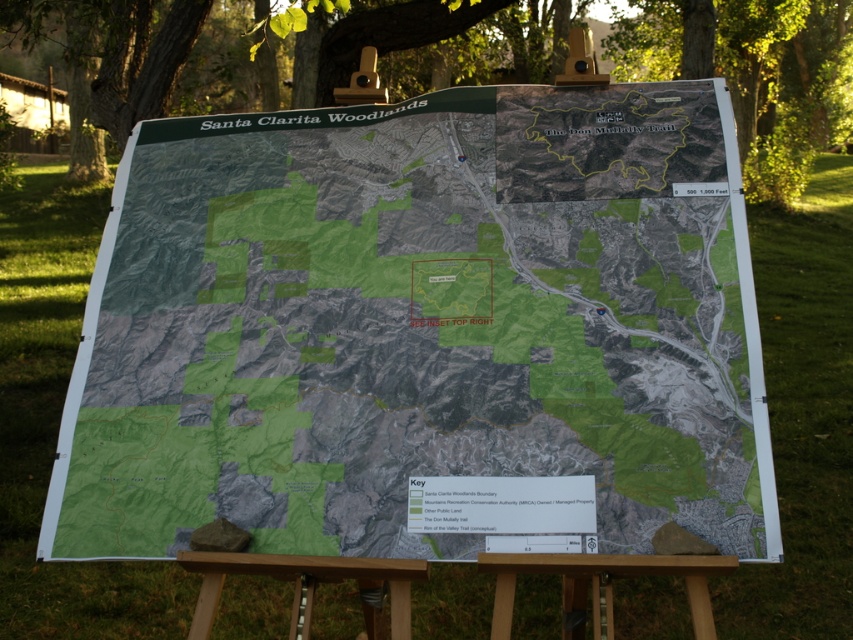
From the picture: You are standing in front of the map titled Santa Clarita Woodlands displayed on an easel. You see two points marked on the map at coordinates point (x=126, y=483) and point (x=815, y=35). If you want to touch the point that is closer to you, which coordinate should you reach for?

You should reach for point (x=126, y=483) because it is closer to the camera than point (x=815, y=35).

You are a hiker planning to use the map displayed on the easel. You notice the green textured map at center and the green leafy tree at upper center. Which object is smaller in size?

The green textured map at center has a smaller size compared to the green leafy tree at upper center, so the map is smaller.

Looking at this image, you are a hiker who wants to consult the map displayed on the easel to plan your route. However, you notice that the green leafy tree at upper center might be casting a shadow over the green textured map at center. Based on their positions, could the tree be blocking sunlight from reaching the map?

The green textured map at center is located below the green leafy tree at upper center, so yes, the tree could be casting a shadow over the map and blocking sunlight from reaching it.